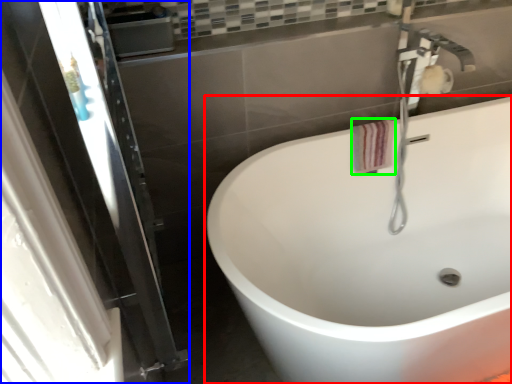
Question: Which object is the closest to the bathtub (highlighted by a red box)? Choose among these: screen door (highlighted by a blue box) or hand towel (highlighted by a green box).

Choices:
 (A) screen door
 (B) hand towel

Answer: (B)